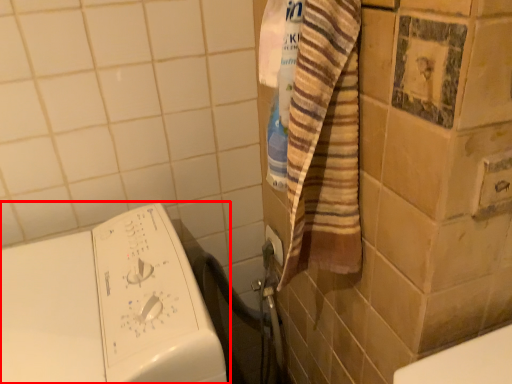
Question: From the image's perspective, what is the correct spatial relationship of washing machine (annotated by the red box) in relation to electric outlet?

Choices:
 (A) above
 (B) below

Answer: (B)